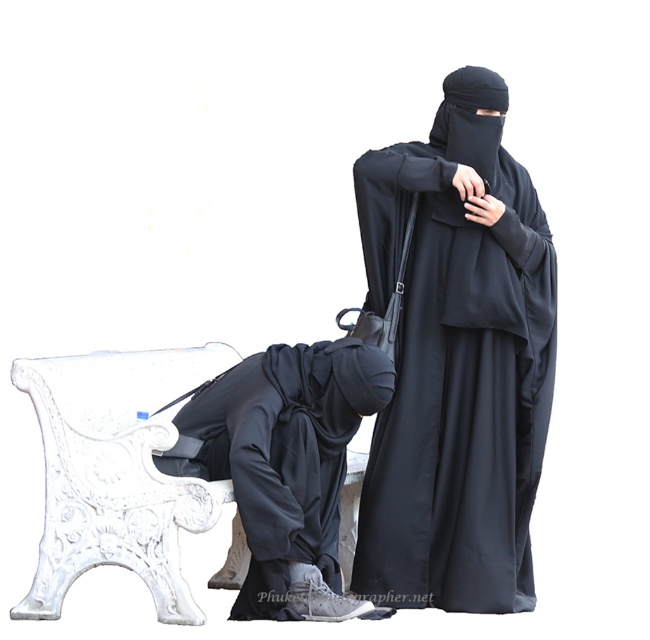
Can you confirm if black matte niqab at center is positioned above matte black clothing at lower left?

Indeed, black matte niqab at center is positioned over matte black clothing at lower left.

Between black matte niqab at center and matte black clothing at lower left, which one appears on the right side from the viewer's perspective?

Positioned to the right is black matte niqab at center.

Who is more forward, (416, 179) or (291, 525)?

Point (291, 525)

This screenshot has height=640, width=650. What are the coordinates of `black matte niqab at center` in the screenshot? It's located at (458, 362).